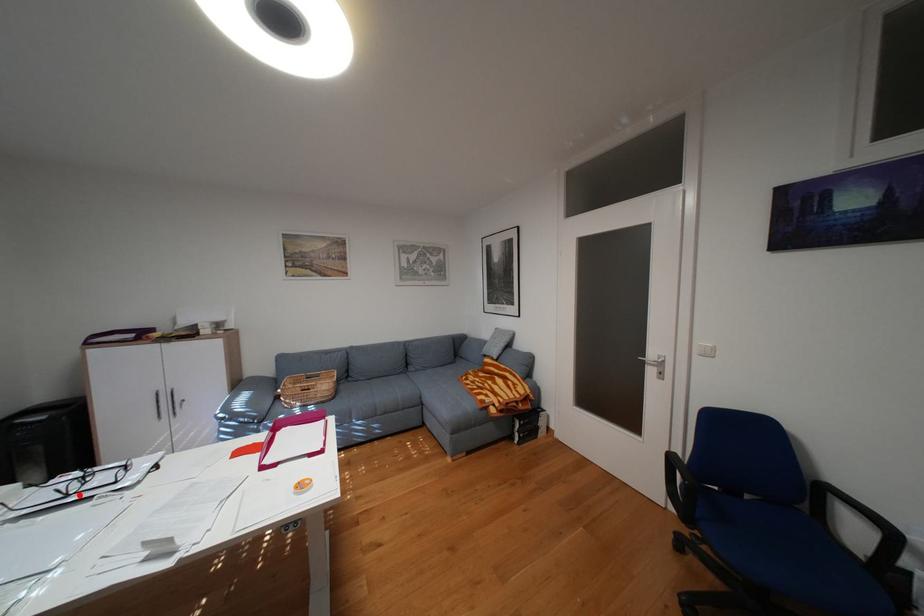
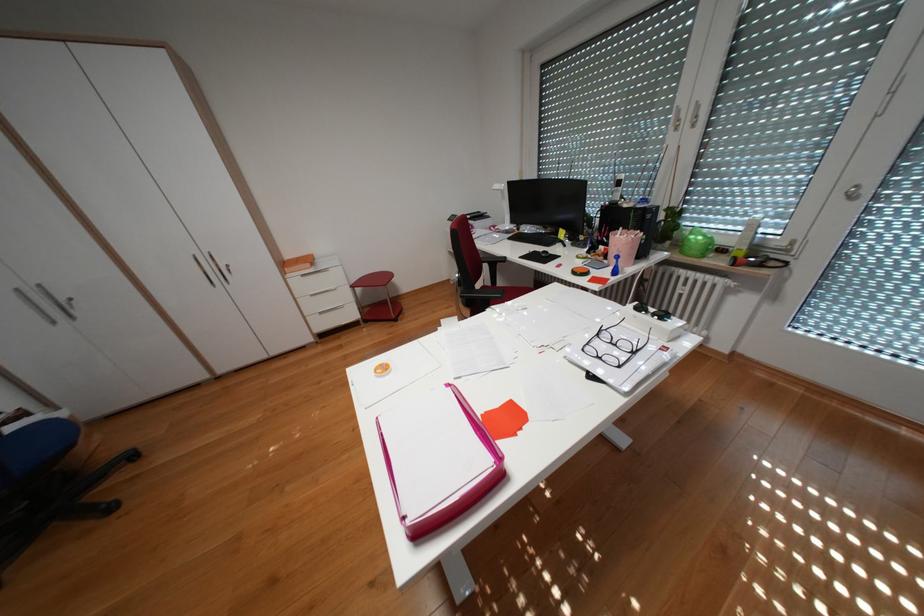
Where in the second image is the point corresponding to the highlighted location from the first image?

(610, 334)